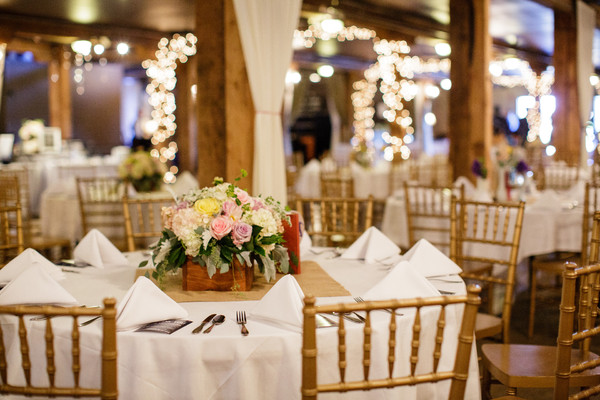
Where is `white curtain`? The width and height of the screenshot is (600, 400). white curtain is located at coordinates (263, 48), (586, 73).